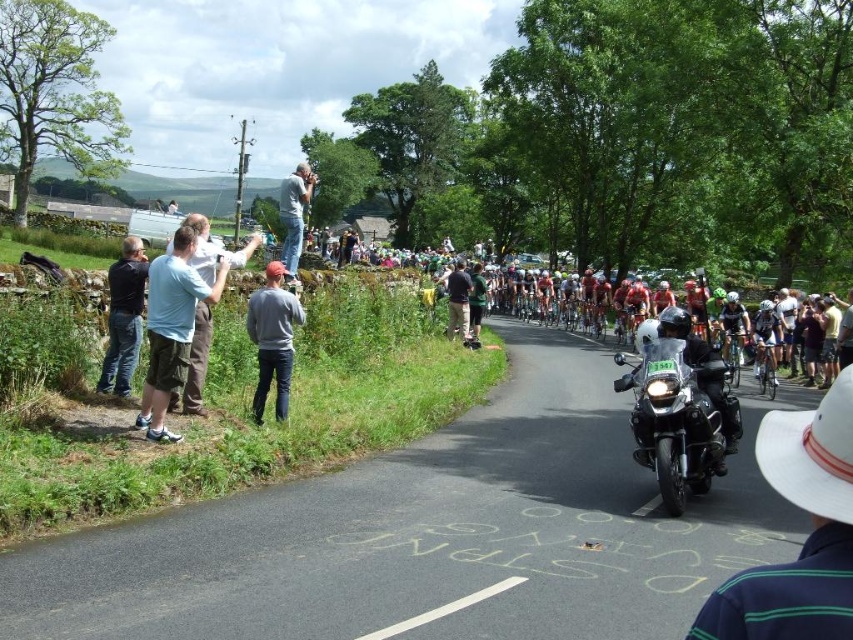
Is light blue t-shirt at left wider than light blue shirt at upper center?

In fact, light blue t-shirt at left might be narrower than light blue shirt at upper center.

Who is more distant from viewer, (193,296) or (287,268)?

The point (287,268) is behind.

Between point (167, 388) and point (291, 182), which one is positioned behind?

Positioned behind is point (291, 182).

Find the location of a particular element. light blue t-shirt at left is located at coordinates (171, 326).

What do you see at coordinates (680, 417) in the screenshot?
I see `shiny black motorcycle at center` at bounding box center [680, 417].

From the picture: Is shiny black motorcycle at center bigger than dark blue jeans at left?

Actually, shiny black motorcycle at center might be smaller than dark blue jeans at left.

Find the location of a particular element. Image resolution: width=853 pixels, height=640 pixels. shiny black motorcycle at center is located at coordinates (680, 417).

Between point (276, 282) and point (286, 253), which one is positioned in front?

Point (276, 282) is more forward.

Is point (282, 307) less distant than point (293, 244)?

That is True.

The height and width of the screenshot is (640, 853). I want to click on gray sweater at center, so click(271, 339).

Find the location of a particular element. This screenshot has height=640, width=853. gray sweater at center is located at coordinates (271, 339).